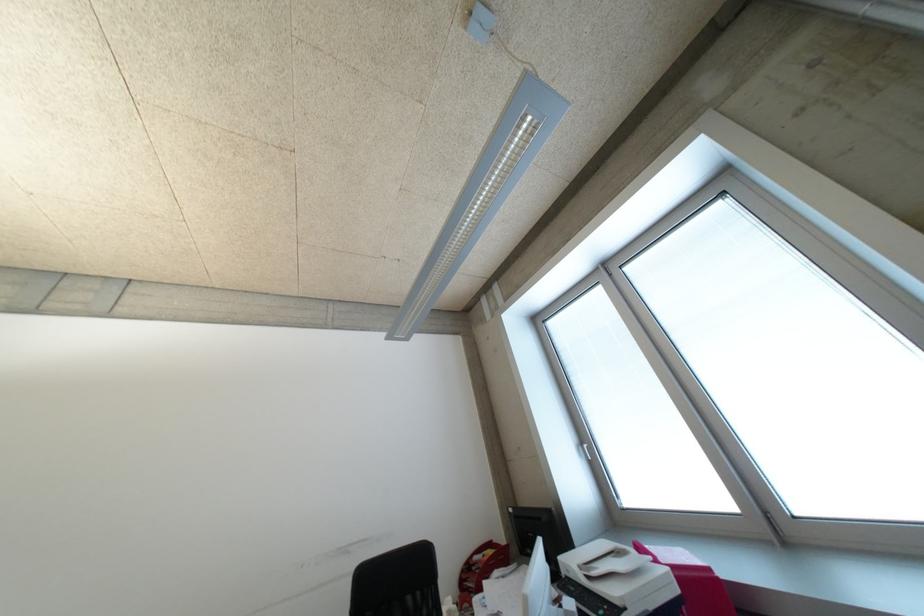
Describe the element at coordinates (588, 452) in the screenshot. The image size is (924, 616). I see `a white window handle` at that location.